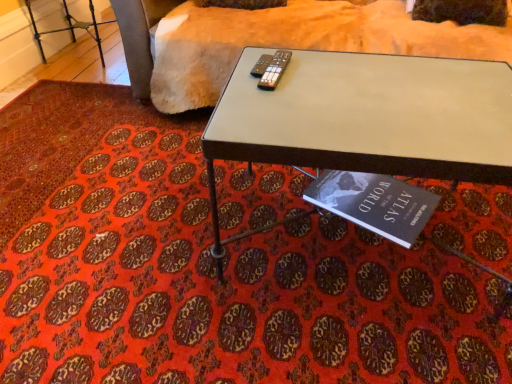
What are the coordinates of `vacant space in front of metallic silver remote at center` in the screenshot? It's located at (283, 93).